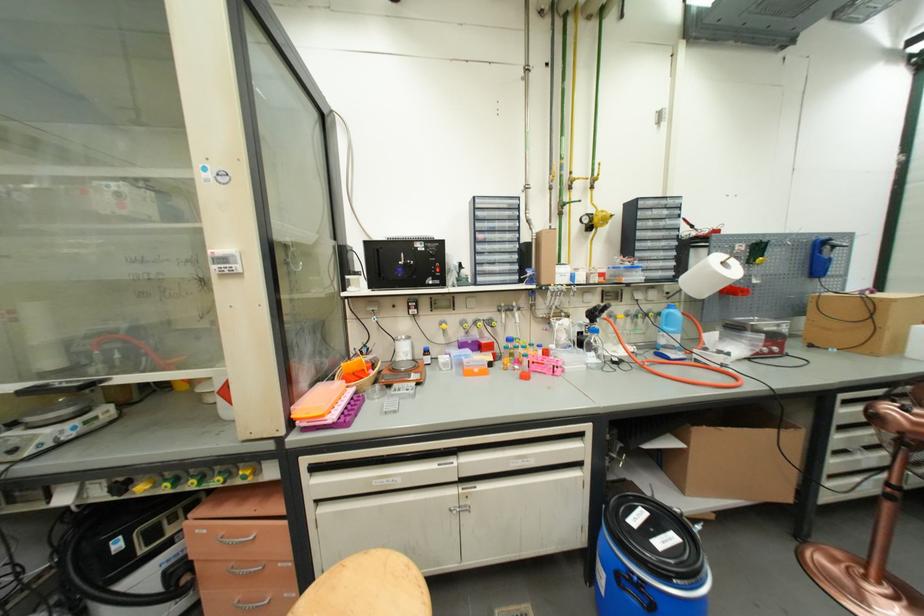
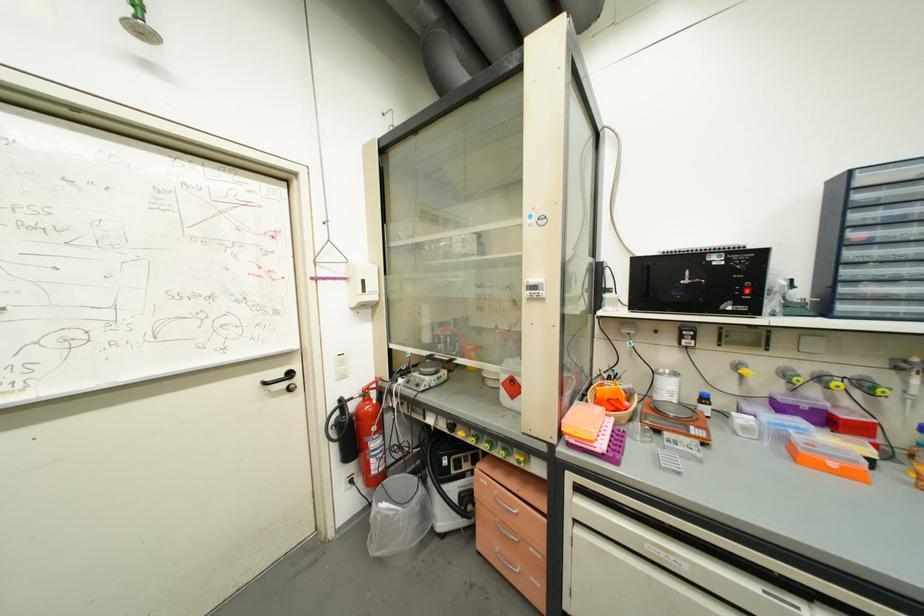
Find the pixel in the second image that matches (x=435, y=284) in the first image.

(735, 310)